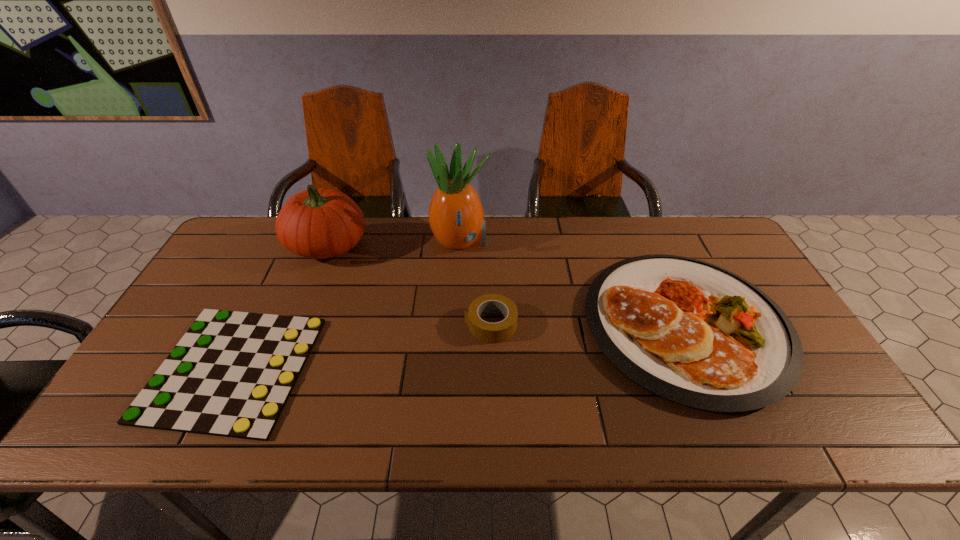
You are a GUI agent. You are given a task and a screenshot of the screen. Output one action in this format:
    pyautogui.click(x=<x>, y=<y>)
    Task: Click on the free location that satisfies the following two spatial constraints: 1. at the entrance of the pineapple; 2. on the back side of the dish
    
    Given the screenshot: What is the action you would take?
    (x=456, y=326)

Image resolution: width=960 pixels, height=540 pixels. Identify the location of blank area in the image that satisfies the following two spatial constraints: 1. on the back side of the shortest object; 2. on the right side of the third shortest object. (253, 326).

At what (x,y) coordinates should I click in order to perform the action: click on free space in the image that satisfies the following two spatial constraints: 1. at the edge of the second shortest object; 2. on the right side of the rightmost object. Please return your answer as a coordinate pair (x, y). The image size is (960, 540). Looking at the image, I should click on (491, 326).